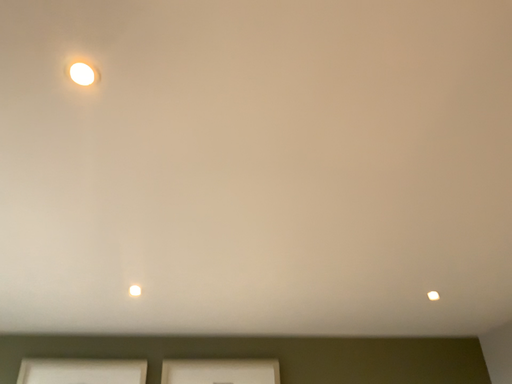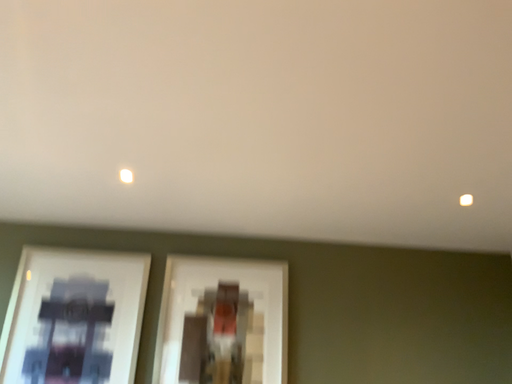
Question: Which way did the camera rotate in the video?

Choices:
 (A) rotated downward
 (B) rotated upward

Answer: (A)